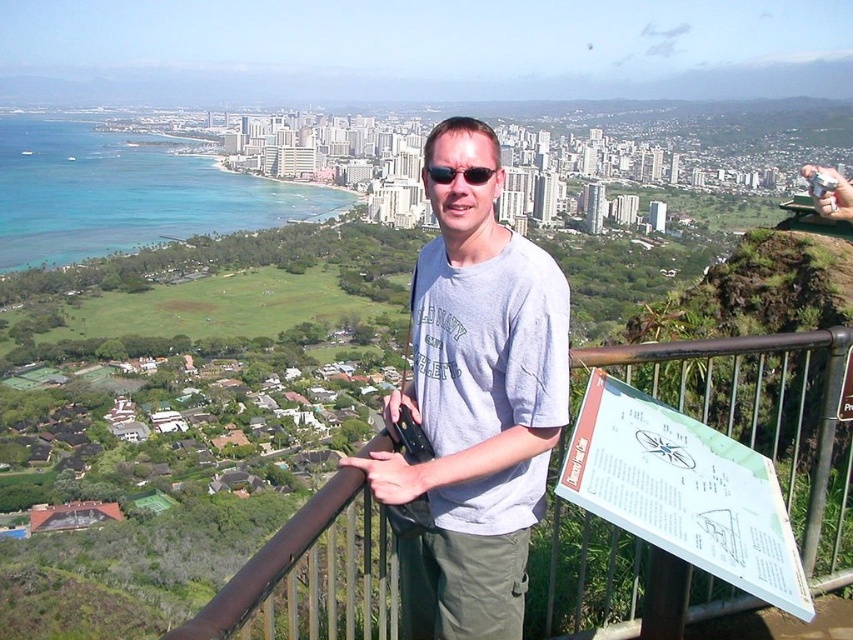
You are standing at the overlook and want to take a photo that includes both the man holding the camera and the distant city skyline. Which point should you focus on first to ensure both are in sharp focus? The options are point A at coordinates point (x=505, y=333) and point B at coordinates point (x=460, y=172).

You should focus on point A at coordinates point (x=505, y=333) first because it is closer to the viewer than point B at coordinates point (x=460, y=172). By focusing on the closer point, the distant city skyline will also be in focus due to the depth of field extending beyond the focal point.